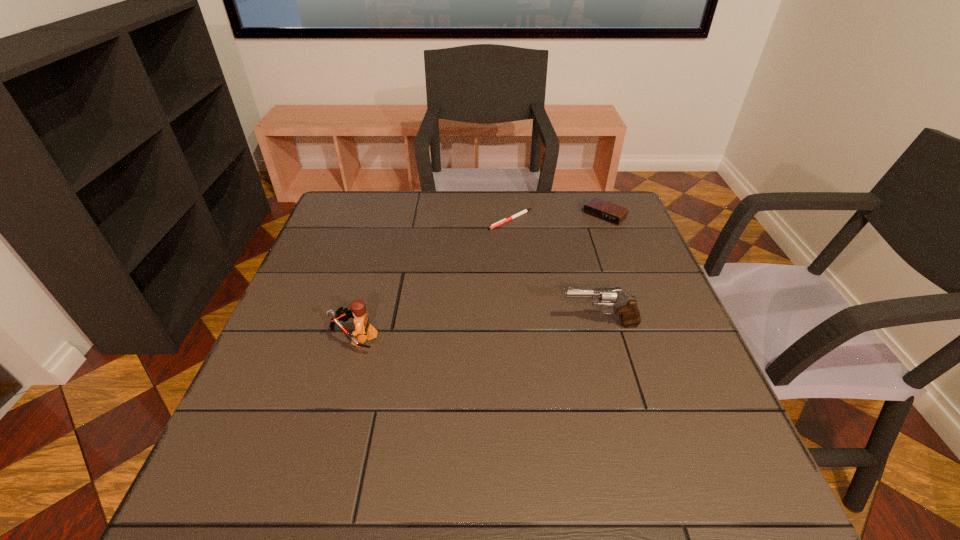
Locate an element on the screen. object located at the far right corner is located at coordinates (598, 208).

In the image, there is a desktop. Identify the location of vacant space at the far edge. (580, 226).

The image size is (960, 540). In order to click on blank space at the near edge of the desktop in this screenshot , I will do `click(324, 437)`.

Locate an element on the screen. free space at the left edge of the desktop is located at coordinates (299, 348).

The image size is (960, 540). What are the coordinates of `free location at the right edge of the desktop` in the screenshot? It's located at (637, 295).

In order to click on free space at the near left corner of the desktop in this screenshot , I will do `click(272, 451)`.

Find the location of a particular element. The image size is (960, 540). free space at the far right corner is located at coordinates (623, 202).

Where is `vacant space that's between the pistol and the Lego`? vacant space that's between the pistol and the Lego is located at coordinates (477, 331).

Find the location of a particular element. free space that is in between the alarm clock and the pen is located at coordinates (558, 218).

The height and width of the screenshot is (540, 960). Identify the location of free area in between the leftmost object and the pen. (433, 279).